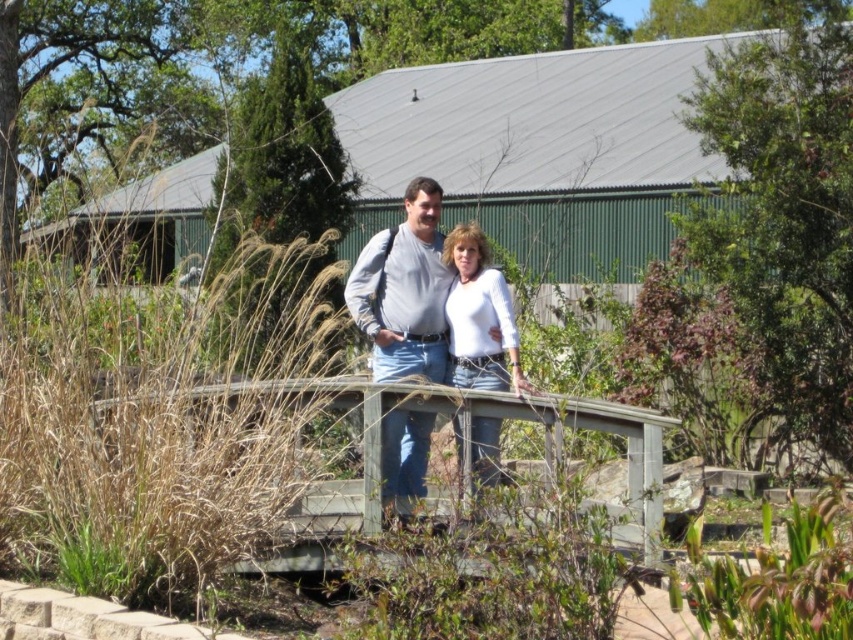
Question: Is wooden rail at center thinner than matte gray shirt at center?

Choices:
 (A) no
 (B) yes

Answer: (A)

Question: Considering the relative positions of matte gray shirt at center and white matte shirt at center in the image provided, where is matte gray shirt at center located with respect to white matte shirt at center?

Choices:
 (A) below
 (B) above

Answer: (B)

Question: Which is nearer to the wooden rail at center?

Choices:
 (A) white matte shirt at center
 (B) matte gray shirt at center

Answer: (A)

Question: Which object is the farthest from the matte gray shirt at center?

Choices:
 (A) wooden rail at center
 (B) white matte shirt at center

Answer: (A)

Question: Based on their relative distances, which object is farther from the white matte shirt at center?

Choices:
 (A) matte gray shirt at center
 (B) wooden rail at center

Answer: (B)

Question: Is wooden rail at center thinner than matte gray shirt at center?

Choices:
 (A) yes
 (B) no

Answer: (B)